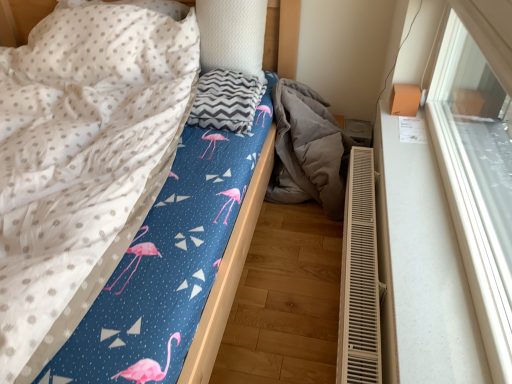
Question: Is white plastic radiator at lower right facing towards white textured pillow at upper center?

Choices:
 (A) yes
 (B) no

Answer: (B)

Question: Can you confirm if white plastic radiator at lower right is shorter than white textured pillow at upper center?

Choices:
 (A) yes
 (B) no

Answer: (A)

Question: From a real-world perspective, is white plastic radiator at lower right positioned over white textured pillow at upper center based on gravity?

Choices:
 (A) yes
 (B) no

Answer: (B)

Question: Is white plastic radiator at lower right turned away from white textured pillow at upper center?

Choices:
 (A) no
 (B) yes

Answer: (A)

Question: From the image's perspective, does white plastic radiator at lower right appear higher than white textured pillow at upper center?

Choices:
 (A) yes
 (B) no

Answer: (B)

Question: From their relative heights in the image, would you say white smooth window sill at right is taller or shorter than white textured pillow at upper center?

Choices:
 (A) tall
 (B) short

Answer: (B)

Question: Is white smooth window sill at right inside the boundaries of white textured pillow at upper center, or outside?

Choices:
 (A) outside
 (B) inside

Answer: (A)

Question: Considering the positions of white smooth window sill at right and white textured pillow at upper center in the image, is white smooth window sill at right wider or thinner than white textured pillow at upper center?

Choices:
 (A) thin
 (B) wide

Answer: (A)

Question: In terms of size, does white smooth window sill at right appear bigger or smaller than white textured pillow at upper center?

Choices:
 (A) big
 (B) small

Answer: (B)

Question: Looking at their shapes, would you say gray fabric at lower right is wider or thinner than white glossy window sill at upper right?

Choices:
 (A) thin
 (B) wide

Answer: (B)

Question: Which is correct: gray fabric at lower right is inside white glossy window sill at upper right, or outside of it?

Choices:
 (A) outside
 (B) inside

Answer: (A)

Question: Considering the relative positions of gray fabric at lower right and white glossy window sill at upper right in the image provided, is gray fabric at lower right to the left or to the right of white glossy window sill at upper right?

Choices:
 (A) left
 (B) right

Answer: (A)

Question: Relative to white glossy window sill at upper right, is gray fabric at lower right in front or behind?

Choices:
 (A) front
 (B) behind

Answer: (B)

Question: Visually, is gray chevron blanket at center positioned to the left or to the right of blue fabric bed at center?

Choices:
 (A) left
 (B) right

Answer: (B)

Question: From a real-world perspective, relative to blue fabric bed at center, is gray chevron blanket at center vertically above or below?

Choices:
 (A) below
 (B) above

Answer: (B)